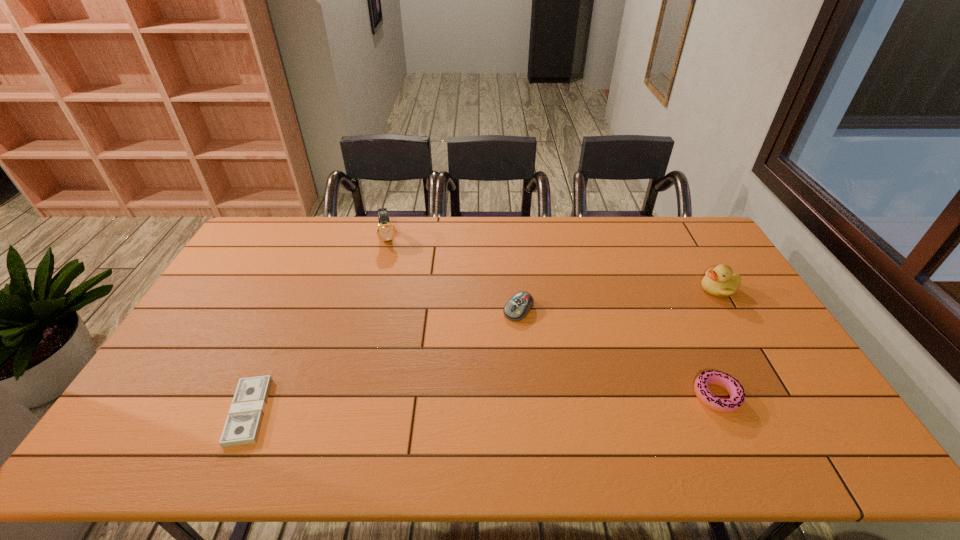
Image resolution: width=960 pixels, height=540 pixels. Find the location of `dollar at the near edge`. dollar at the near edge is located at coordinates (242, 427).

At what (x,y) coordinates should I click in order to perform the action: click on doughnut present at the near edge. Please return your answer as a coordinate pair (x, y). Looking at the image, I should click on (736, 391).

The width and height of the screenshot is (960, 540). I want to click on object that is at the right edge, so click(719, 281).

This screenshot has height=540, width=960. Identify the location of free spot at the far edge of the desktop. (377, 240).

At what (x,y) coordinates should I click in order to perform the action: click on free region at the near edge of the desktop. Please return your answer as a coordinate pair (x, y). Image resolution: width=960 pixels, height=540 pixels. Looking at the image, I should click on (658, 391).

The image size is (960, 540). What are the coordinates of `vacant space at the left edge of the desktop` in the screenshot? It's located at (211, 332).

Identify the location of vacant space at the right edge of the desktop. This screenshot has height=540, width=960. (684, 262).

In the image, there is a desktop. Where is `free space at the near left corner`? free space at the near left corner is located at coordinates (157, 396).

In the image, there is a desktop. Where is `vacant space at the far right corner`? The width and height of the screenshot is (960, 540). vacant space at the far right corner is located at coordinates (678, 240).

This screenshot has height=540, width=960. Find the location of `free space at the near right corner of the desktop`. free space at the near right corner of the desktop is located at coordinates (764, 392).